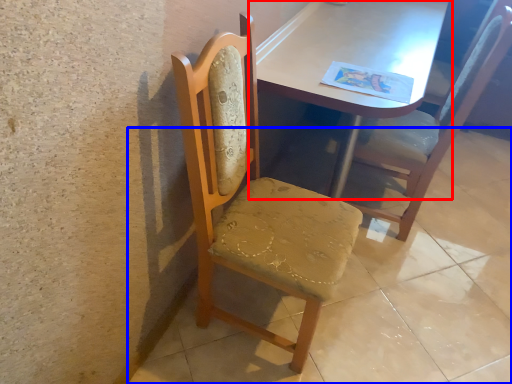
Question: Among these objects, which one is nearest to the camera, table (highlighted by a red box) or concrete (highlighted by a blue box)?

Choices:
 (A) table
 (B) concrete

Answer: (B)